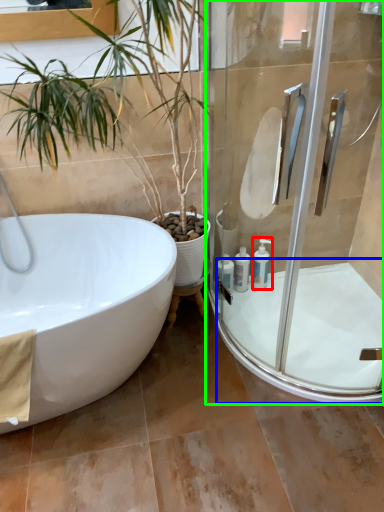
Question: Which is farther away from toiletry (highlighted by a red box)? bath (highlighted by a blue box) or shower door (highlighted by a green box)?

Choices:
 (A) bath
 (B) shower door

Answer: (B)